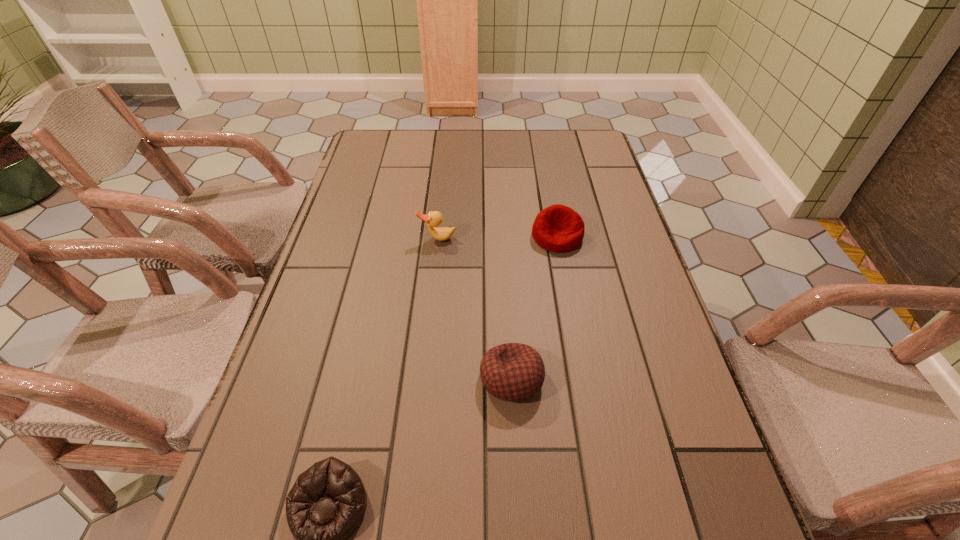
You are a GUI agent. You are given a task and a screenshot of the screen. Output one action in this format:
    pyautogui.click(x=<x>, y=<y>)
    Task: Click on the beanbag that stands as the third closest to the third object from right to left
    The width and height of the screenshot is (960, 540).
    Given the screenshot: What is the action you would take?
    pyautogui.click(x=328, y=501)

At what (x,y) coordinates should I click in order to perform the action: click on free location that satisfies the following two spatial constraints: 1. on the beak of the second object from left to right; 2. on the right side of the third object from left to right. Please return your answer as a coordinate pair (x, y). Looking at the image, I should click on (423, 379).

At what (x,y) coordinates should I click in order to perform the action: click on vacant point that satisfies the following two spatial constraints: 1. on the beak of the second object from left to right; 2. on the left side of the second beanbag from left to right. Please return your answer as a coordinate pair (x, y). The image size is (960, 540). Looking at the image, I should click on (423, 379).

Find the location of `blank space that satisfies the following two spatial constraints: 1. on the beak of the second farthest beanbag; 2. on the left side of the second object from left to right`. blank space that satisfies the following two spatial constraints: 1. on the beak of the second farthest beanbag; 2. on the left side of the second object from left to right is located at coordinates (423, 379).